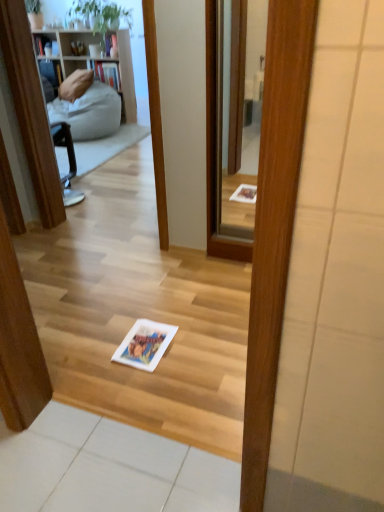
Where is `free space above white paper book at center (from a real-world perspective)`? free space above white paper book at center (from a real-world perspective) is located at coordinates (144, 342).